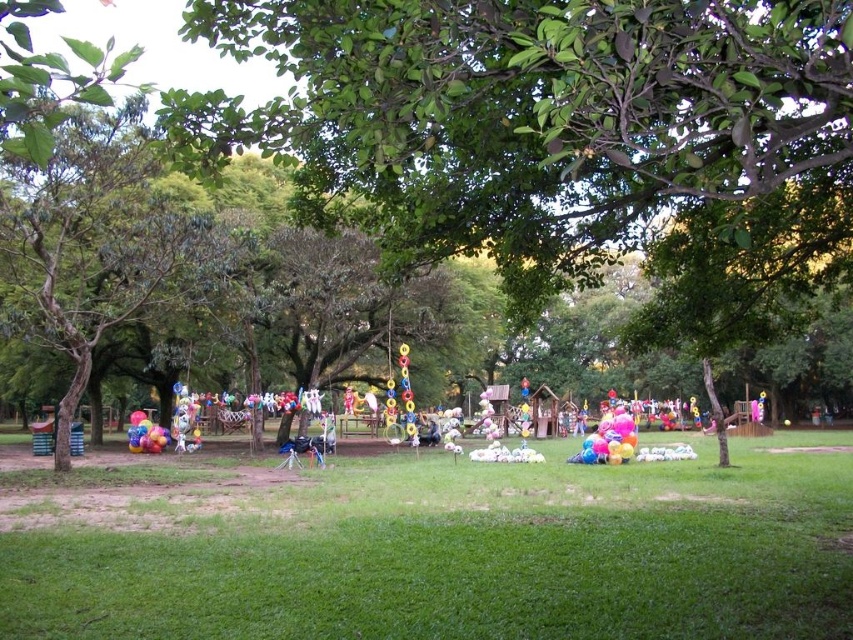
You are planning to set up a picnic blanket in the park. Considering the green leafy tree at center and the green grass at center, which area would provide more shade?

The green leafy tree at center has a larger size compared to the green grass at center, so it would provide more shade for the picnic blanket.

You are standing at the origin point of the coordinate system in this park scene. The green leafy tree at center is located at coordinates 0.205 in the x direction and 0.652 in the y direction. If you want to walk directly towards the tree, which direction should you head? Please provide your answer in terms of compass directions like north, south, east, or west.

→ The green leafy tree at center is located at coordinates x 0.205 and y 0.652. Since the origin is at the bottom left corner of the image, moving towards higher x values means going east, and higher y values mean going north. To reach the tree, you should head northeast.

You are planning to set up a picnic blanket in the center of the park. The picnic blanket requires a space that is wider than the green leafy tree at center. Can you determine if the green grass at center will provide enough width for the picnic blanket?

The green leafy tree at center is thinner than the green grass at center. Since the picnic blanket requires a space wider than the green leafy tree at center, the green grass at center is wider than the required space, so yes, it can accommodate the picnic blanket.